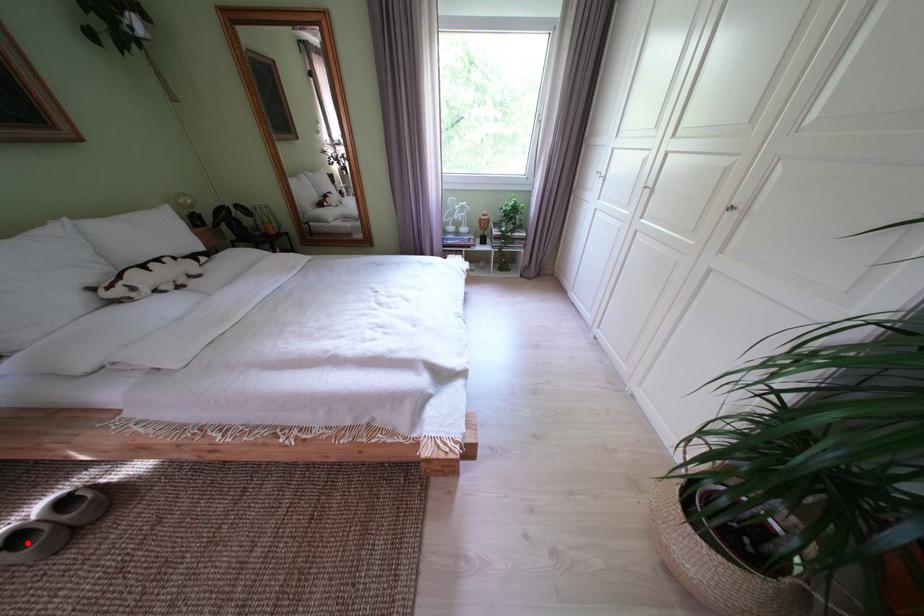
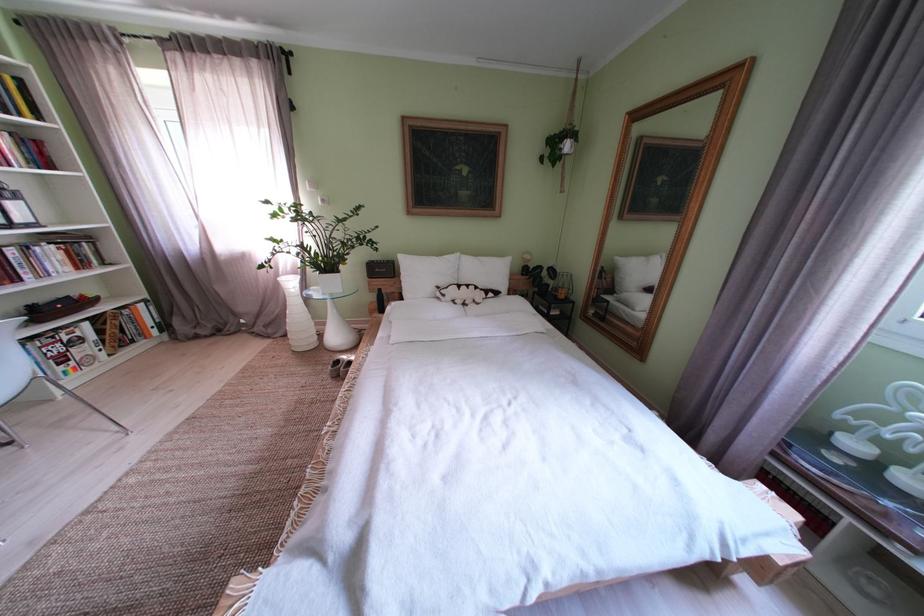
Locate, in the second image, the point that corresponds to the highlighted location in the first image.

(348, 367)